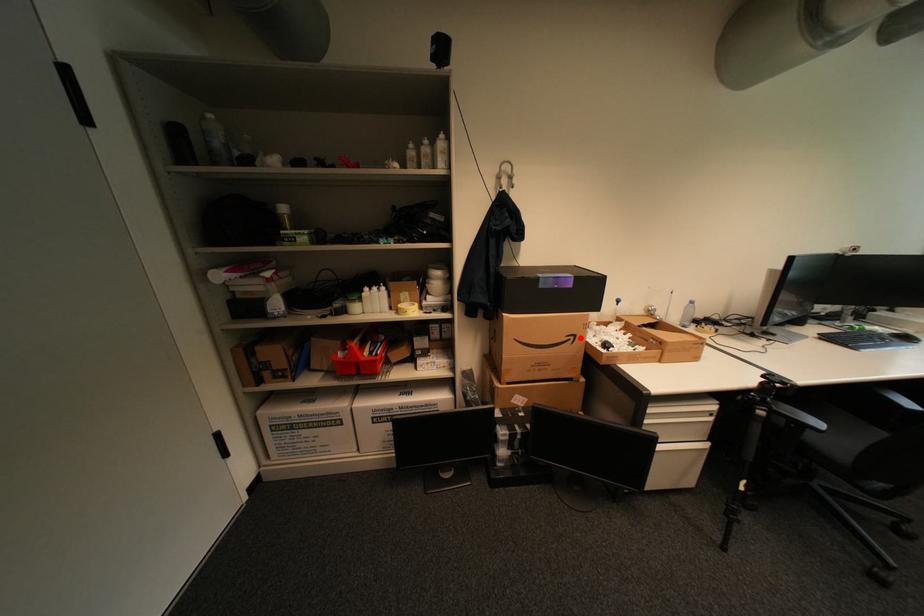
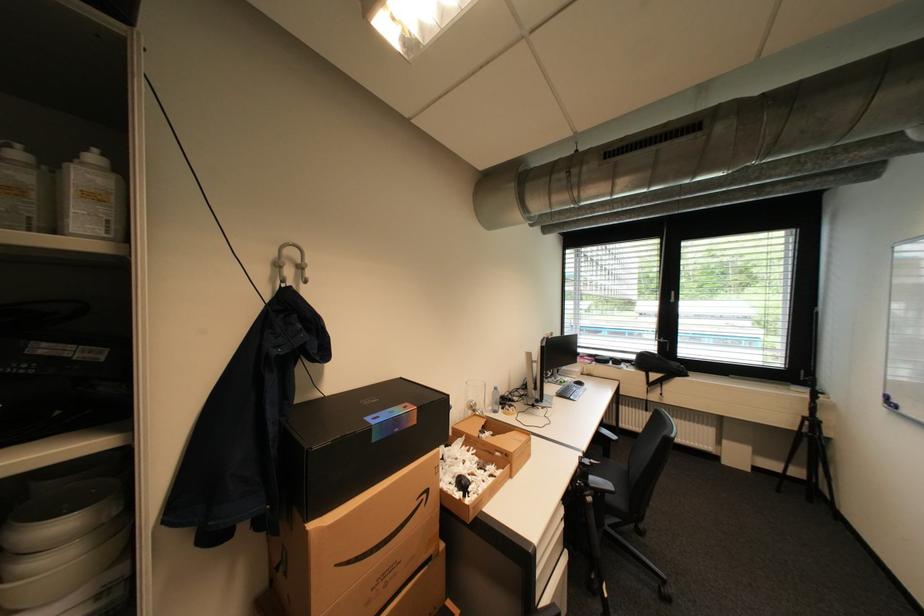
Question: A red point is marked in image1. In image2, is the corresponding 3D point closer to the camera or farther? Reply with the corresponding letter.

Choices:
 (A) The corresponding 3D point is closer.
 (B) The corresponding 3D point is farther.

Answer: (B)